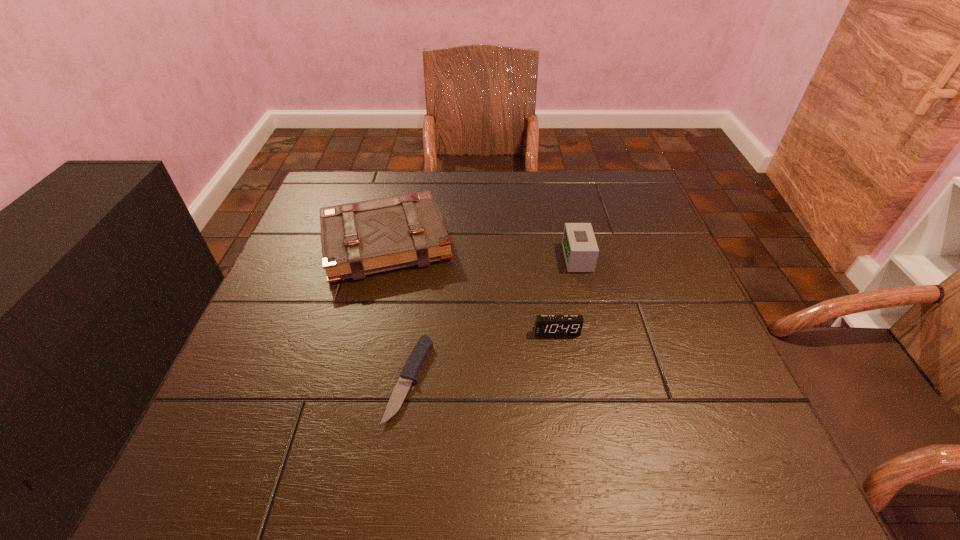
The height and width of the screenshot is (540, 960). What are the coordinates of `hardback book` in the screenshot? It's located at pos(360,238).

This screenshot has height=540, width=960. I want to click on the farther alarm clock, so click(x=580, y=248).

Identify the location of the rightmost object. 580,248.

What are the coordinates of `the left alarm clock` in the screenshot? It's located at (545, 325).

Image resolution: width=960 pixels, height=540 pixels. I want to click on the third tallest object, so click(x=545, y=325).

This screenshot has height=540, width=960. In order to click on the shortest object in this screenshot , I will do `click(417, 357)`.

Find the location of `steak knife`. steak knife is located at coordinates (417, 357).

Identify the location of vacant space located 0.320m on the right of the hardback book. (580, 242).

This screenshot has width=960, height=540. I want to click on vacant region located on the front-facing side of the taller alarm clock, so click(470, 258).

The width and height of the screenshot is (960, 540). I want to click on free space located 0.100m on the front-facing side of the taller alarm clock, so click(x=524, y=258).